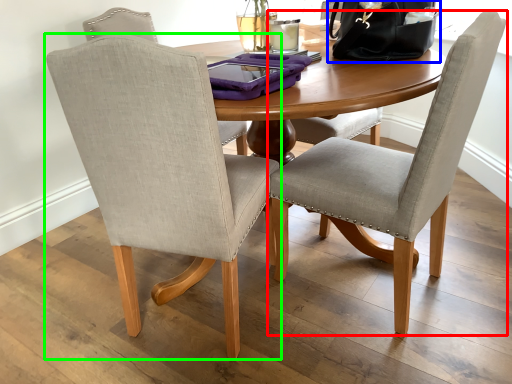
Question: Based on their relative distances, which object is farther from chair (highlighted by a red box)? Choose from handbag (highlighted by a blue box) and chair (highlighted by a green box).

Choices:
 (A) handbag
 (B) chair

Answer: (A)